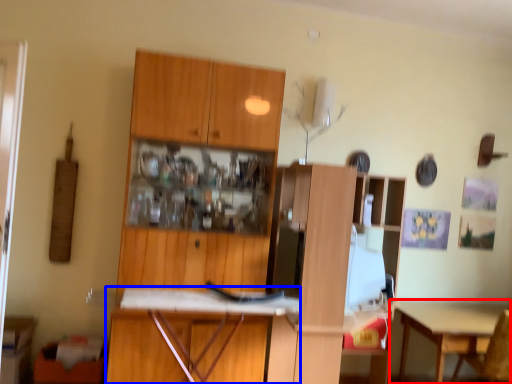
Question: Which object is further to the camera taking this photo, table (highlighted by a red box) or desk (highlighted by a blue box)?

Choices:
 (A) table
 (B) desk

Answer: (A)